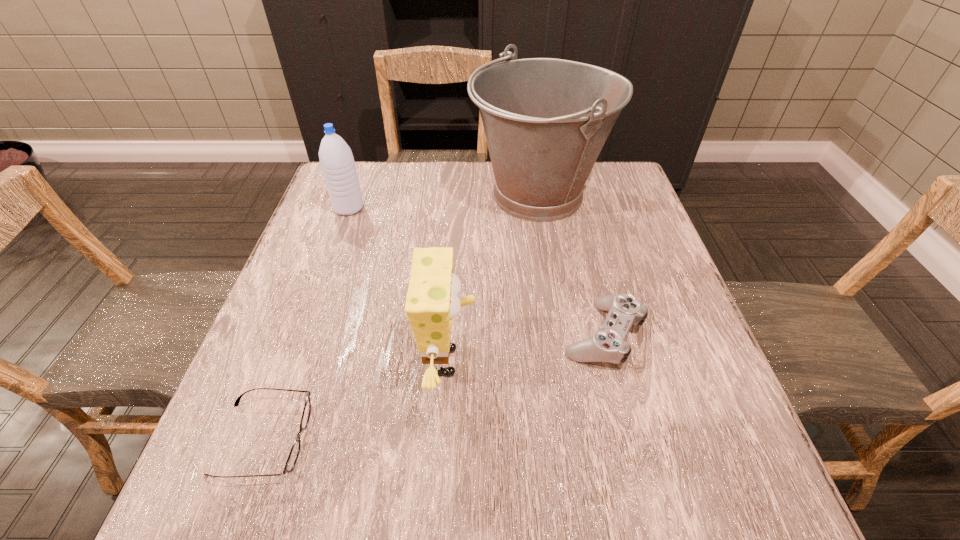
This screenshot has width=960, height=540. In the image, there is a desktop. What are the coordinates of `vacant space at the far edge` in the screenshot? It's located at (490, 200).

Where is `vacant space at the near edge`? This screenshot has height=540, width=960. vacant space at the near edge is located at coordinates (639, 483).

Locate an element on the screen. This screenshot has width=960, height=540. free space at the left edge of the desktop is located at coordinates tap(338, 258).

This screenshot has width=960, height=540. In order to click on free space at the right edge in this screenshot , I will do point(720,446).

You are a GUI agent. You are given a task and a screenshot of the screen. Output one action in this format:
    pyautogui.click(x=<x>, y=<y>)
    Task: Click on the free space at the near left corner of the desktop
    This screenshot has height=540, width=960.
    Given the screenshot: What is the action you would take?
    pyautogui.click(x=282, y=509)

What are the coordinates of `vacant region at the far right corner` in the screenshot? It's located at (596, 171).

You are a GUI agent. You are given a task and a screenshot of the screen. Output one action in this format:
    pyautogui.click(x=<x>, y=<y>)
    Task: Click on the blank region between the tallest object and the control
    The width and height of the screenshot is (960, 540).
    Given the screenshot: What is the action you would take?
    pyautogui.click(x=571, y=265)

Find the location of a particular element. The width and height of the screenshot is (960, 540). free space between the water bottle and the sponge is located at coordinates (399, 285).

At what (x,y) coordinates should I click in order to perform the action: click on vacant space that is in between the bucket and the water bottle. Please return your answer as a coordinate pair (x, y). The width and height of the screenshot is (960, 540). Looking at the image, I should click on coord(444,202).

The width and height of the screenshot is (960, 540). Find the location of `free space that is in between the bucket and the shortest object`. free space that is in between the bucket and the shortest object is located at coordinates (401, 318).